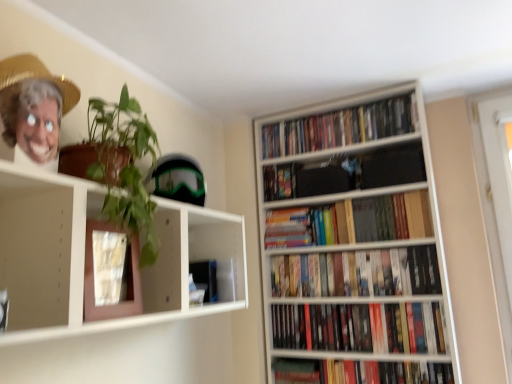
Where is `free spot above hardcover book at center, which is the fourth book in top-to-bottom order (from a real-world perspective)`? This screenshot has height=384, width=512. free spot above hardcover book at center, which is the fourth book in top-to-bottom order (from a real-world perspective) is located at coordinates (290, 208).